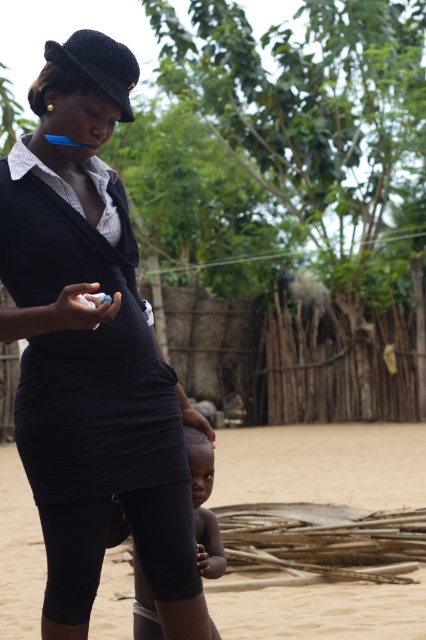
Does black matte dress at center have a lesser height compared to brown sandy dirt at center?

No.

Is point (2, 317) farther from viewer compared to point (109, 596)?

No, it is in front of (109, 596).

You are a GUI agent. You are given a task and a screenshot of the screen. Output one action in this format:
    pyautogui.click(x=<x>, y=<y>)
    Task: Click on the black matte dress at center
    Image resolution: width=426 pixels, height=640 pixels.
    Given the screenshot: What is the action you would take?
    pyautogui.click(x=92, y=349)

Who is positioned more to the right, brown sandy dirt at center or dark skin baby at lower center?

dark skin baby at lower center is more to the right.

Between brown sandy dirt at center and dark skin baby at lower center, which one is positioned lower?

brown sandy dirt at center is lower down.

What do you see at coordinates (322, 465) in the screenshot?
I see `brown sandy dirt at center` at bounding box center [322, 465].

Image resolution: width=426 pixels, height=640 pixels. I want to click on brown sandy dirt at center, so click(322, 465).

Which is below, black matte dress at center or dark skin baby at lower center?

dark skin baby at lower center

Between point (94, 225) and point (135, 632), which one is positioned behind?

Point (135, 632)

Where is `black matte dress at center`? Image resolution: width=426 pixels, height=640 pixels. black matte dress at center is located at coordinates (92, 349).

Find the location of a particular element. The width and height of the screenshot is (426, 640). black matte dress at center is located at coordinates (92, 349).